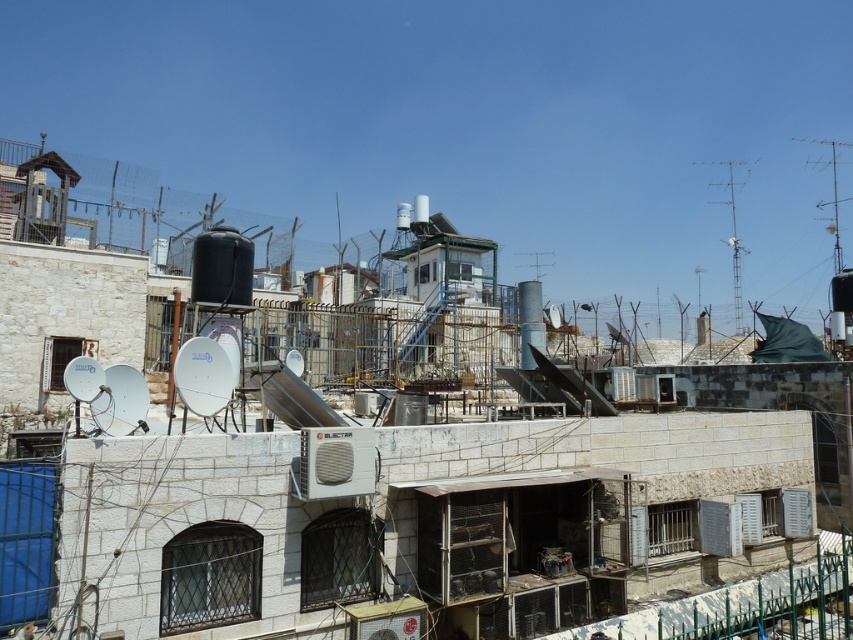
Question: Does metallic gray solar panel at center have a greater width compared to metallic silver dish antenna at upper right?

Choices:
 (A) no
 (B) yes

Answer: (A)

Question: Which point is closer to the camera?

Choices:
 (A) metallic silver dish antenna at upper right
 (B) metallic gray solar panel at center

Answer: (B)

Question: Does metallic gray solar panel at center appear over metallic silver dish antenna at upper right?

Choices:
 (A) no
 (B) yes

Answer: (A)

Question: Which object appears farthest from the camera in this image?

Choices:
 (A) metallic gray solar panel at center
 (B) metallic silver dish antenna at upper right

Answer: (B)

Question: Does metallic gray solar panel at center have a lesser width compared to metallic silver dish antenna at upper right?

Choices:
 (A) no
 (B) yes

Answer: (B)